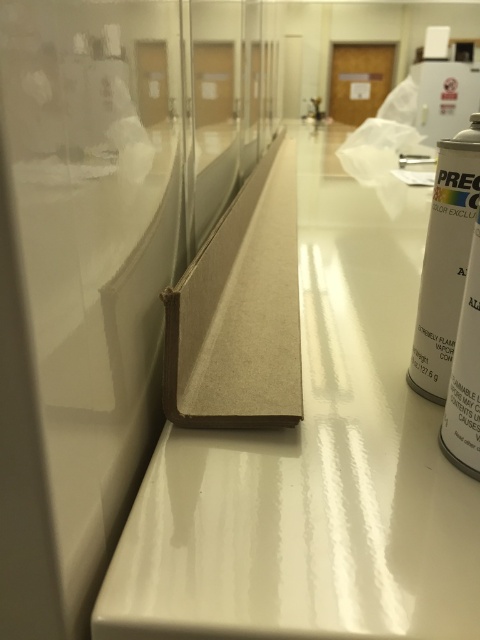
You are an inspector checking the lab setup. You notice the brown cardboard at center and the white matte spray can at right. Which object is taller?

The brown cardboard at center is much taller than the white matte spray can at right.

You are holding a measuring tape and need to reach a point that is exactly 16.27 inches away from your current position. According to the scene, can you reach the point marked by the coordinates point (347, 529) without moving your feet?

Yes, because the point (347, 529) is exactly 16.27 inches away from the viewer, which matches the required distance.